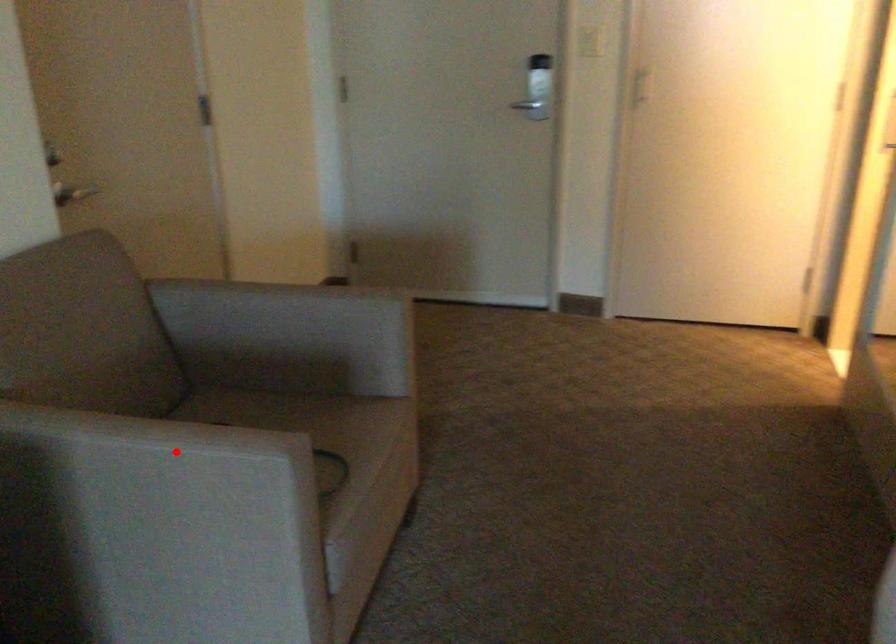
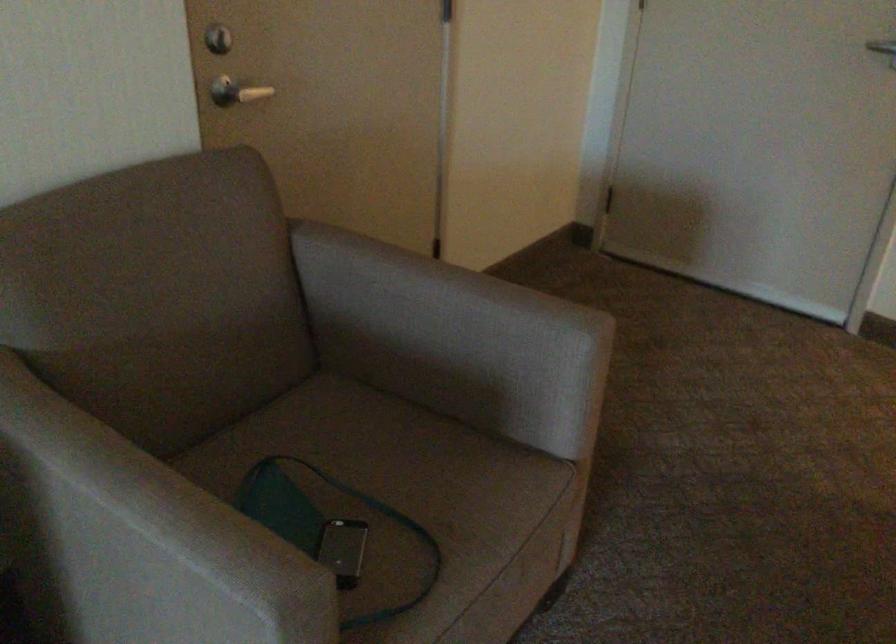
Find the pixel in the second image that matches the highlighted location in the first image.

(150, 538)